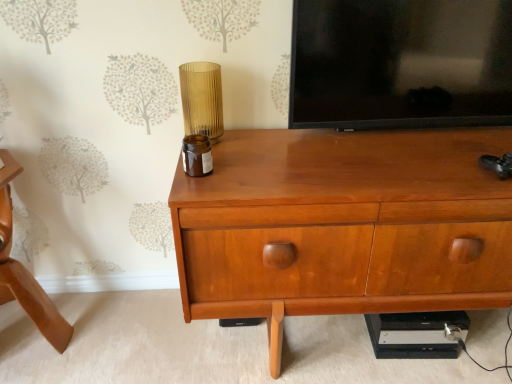
Question: Considering the positions of wooden chest of drawers at center and translucent amber glass at center in the image, is wooden chest of drawers at center taller or shorter than translucent amber glass at center?

Choices:
 (A) short
 (B) tall

Answer: (B)

Question: Is wooden chest of drawers at center to the left or to the right of translucent amber glass at center in the image?

Choices:
 (A) left
 (B) right

Answer: (B)

Question: Estimate the real-world distances between objects in this image. Which object is closer to the black glossy tv at upper center?

Choices:
 (A) translucent amber glass at center
 (B) wooden chair at lower left
 (C) wooden chest of drawers at center

Answer: (C)

Question: Considering the real-world distances, which object is farthest from the translucent amber glass at center?

Choices:
 (A) wooden chair at lower left
 (B) wooden chest of drawers at center
 (C) black glossy tv at upper center

Answer: (A)